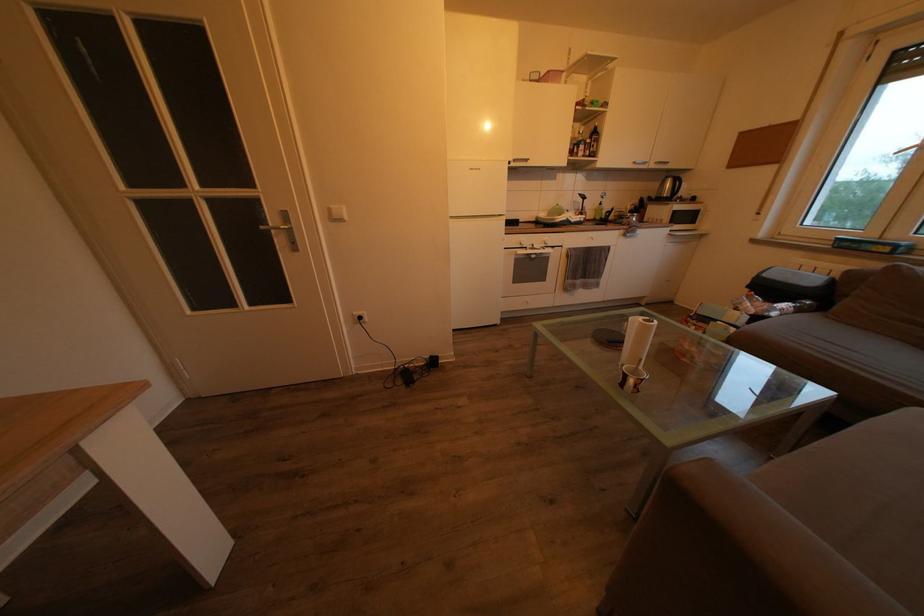
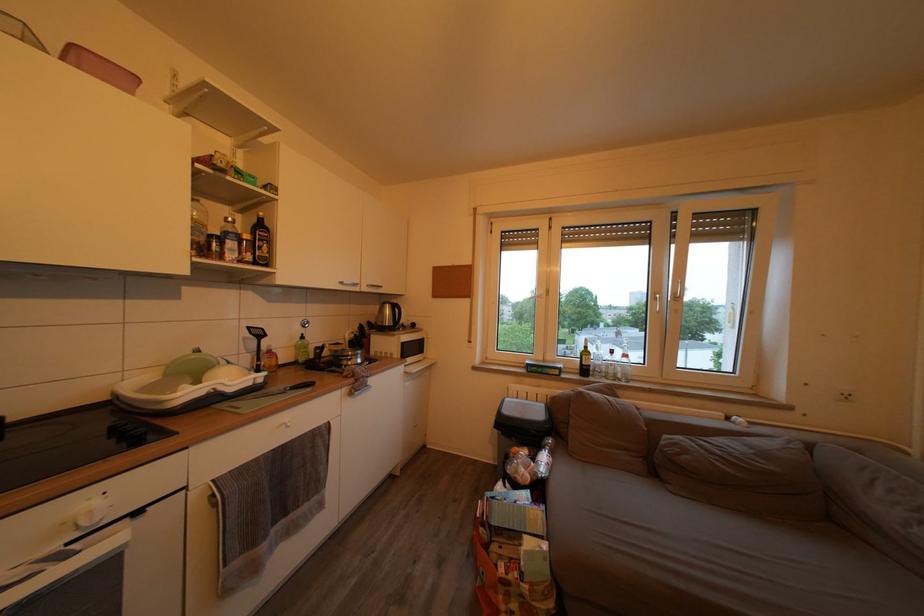
Where in the second image is the point corresponding to the point at 596,147 from the first image?

(253, 243)